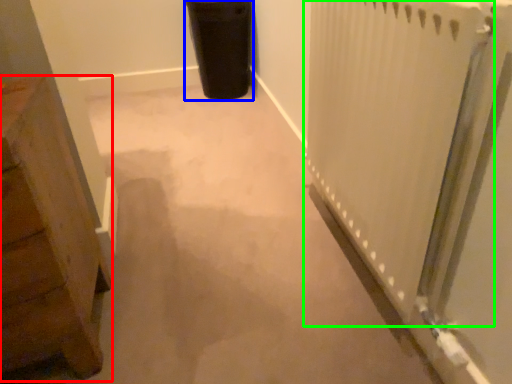
Question: Considering the real-world distances, which object is closest to furniture (highlighted by a red box)? garbage (highlighted by a blue box) or radiator (highlighted by a green box).

Choices:
 (A) garbage
 (B) radiator

Answer: (B)